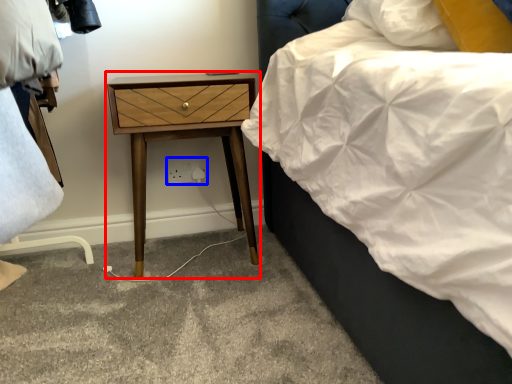
Question: Which object is further to the camera taking this photo, nightstand (highlighted by a red box) or electric outlet (highlighted by a blue box)?

Choices:
 (A) nightstand
 (B) electric outlet

Answer: (B)